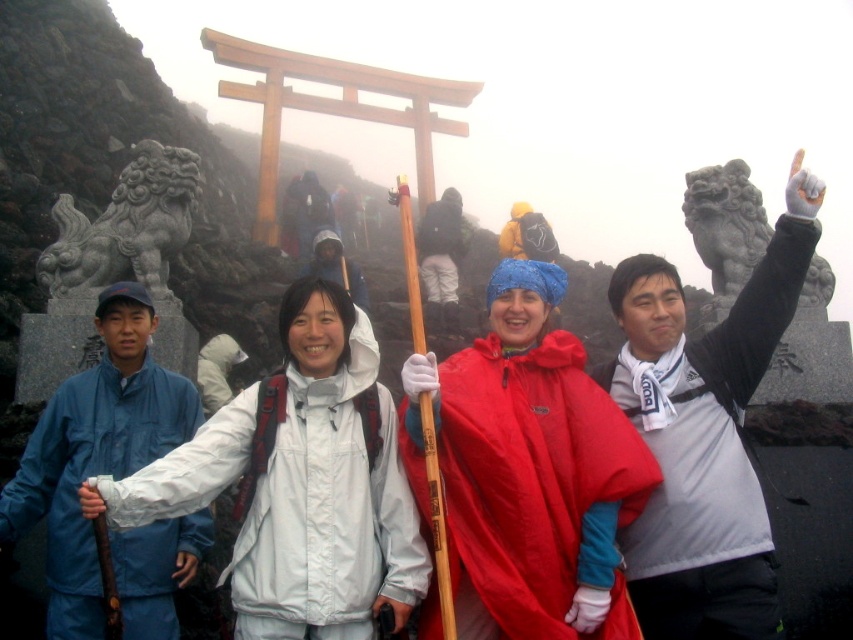
Looking at this image, who is higher up, red matte raincoat at center or stone lion at upper center?

stone lion at upper center is above.

Measure the distance between red matte raincoat at center and camera.

51.75 meters

You are a GUI agent. You are given a task and a screenshot of the screen. Output one action in this format:
    pyautogui.click(x=<x>, y=<y>)
    Task: Click on the red matte raincoat at center
    Image resolution: width=853 pixels, height=640 pixels.
    Given the screenshot: What is the action you would take?
    pyautogui.click(x=527, y=470)

Between white matte jacket at center and stone lion at upper center, which one appears on the right side from the viewer's perspective?

stone lion at upper center

Can you confirm if white matte jacket at center is positioned below stone lion at upper center?

Yes, white matte jacket at center is below stone lion at upper center.

Who is more distant from viewer, (350, 317) or (715, 240)?

The point (715, 240) is behind.

In order to click on white matte jacket at center in this screenshot , I will do `click(328, 490)`.

Does white fabric at upper right have a greater width compared to blue fabric jacket at left?

Yes.

Is white fabric at upper right smaller than blue fabric jacket at left?

No.

Who is more forward, (x=735, y=554) or (x=120, y=547)?

Positioned in front is point (x=735, y=554).

Locate an element on the screen. white fabric at upper right is located at coordinates (705, 435).